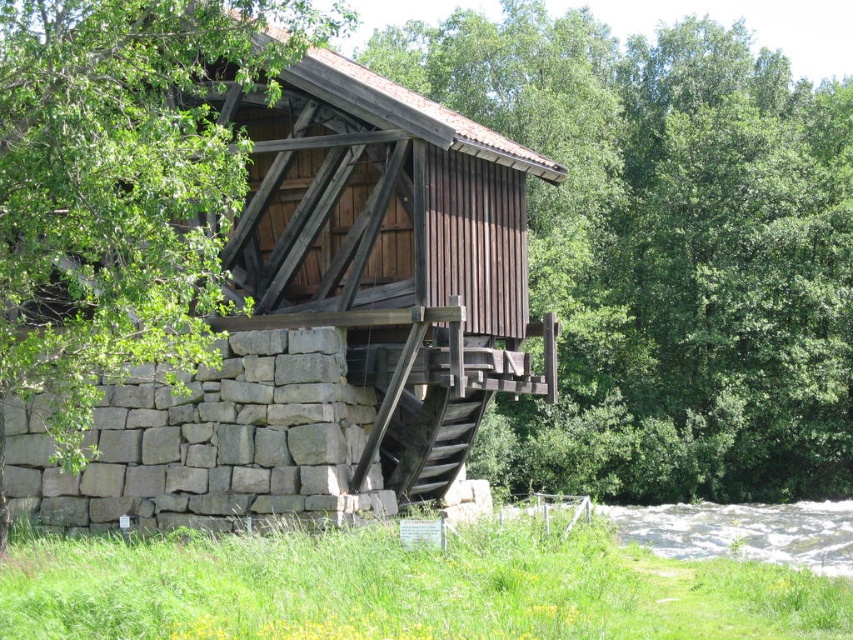
Question: Does brown wooden hut at center appear over white frothy water at lower right?

Choices:
 (A) no
 (B) yes

Answer: (B)

Question: Which of the following is the closest to the observer?

Choices:
 (A) (280, 243)
 (B) (665, 285)

Answer: (A)

Question: Among these objects, which one is farthest from the camera?

Choices:
 (A) white frothy water at lower right
 (B) brown wooden hut at center

Answer: (A)

Question: Which point is closer to the camera?

Choices:
 (A) brown wooden hut at center
 (B) white frothy water at lower right
 (C) brown wood tree at center

Answer: (A)

Question: Is brown wooden hut at center thinner than white frothy water at lower right?

Choices:
 (A) yes
 (B) no

Answer: (A)

Question: Is brown wood tree at center positioned before brown wooden hut at center?

Choices:
 (A) yes
 (B) no

Answer: (B)